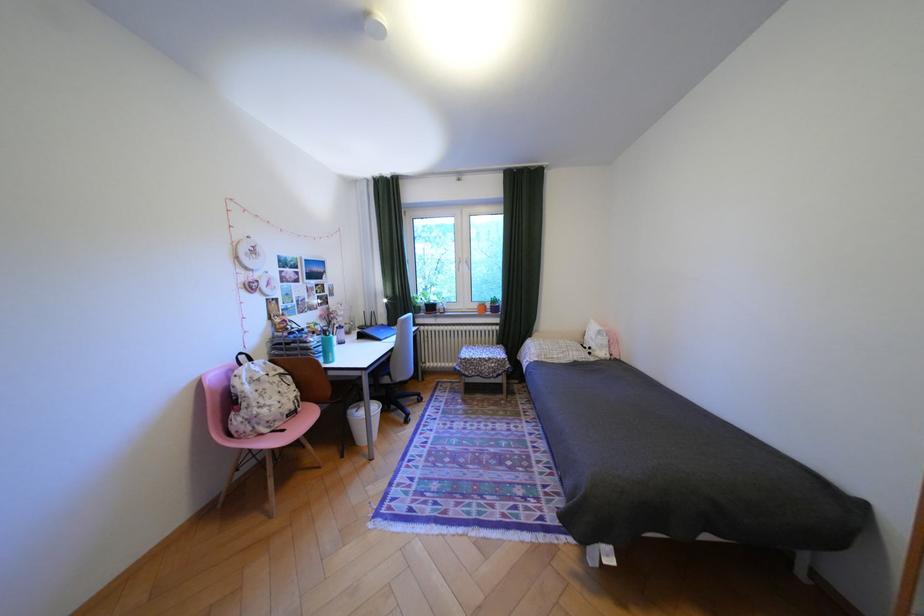
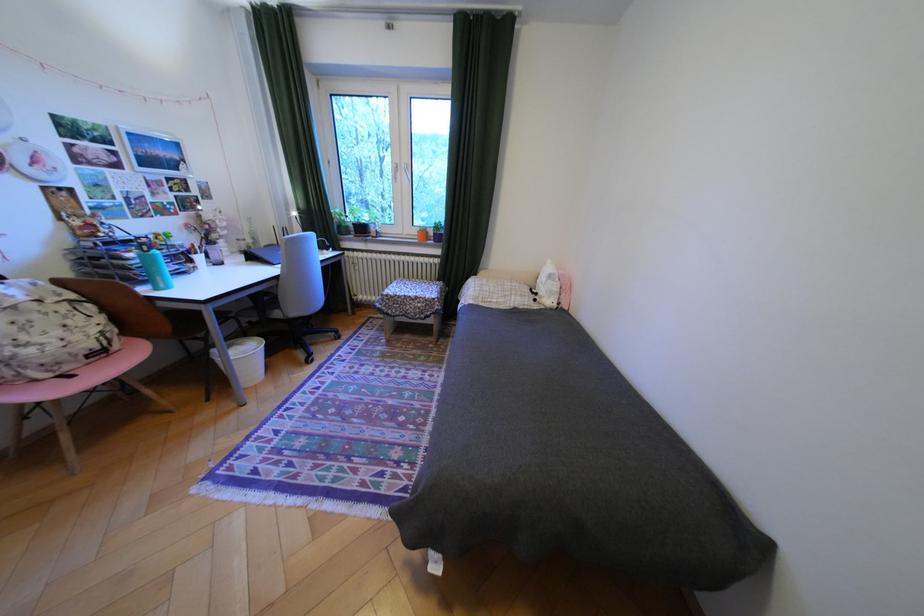
In the second image, find the point that corresponds to point 289,424 in the first image.

(79, 368)